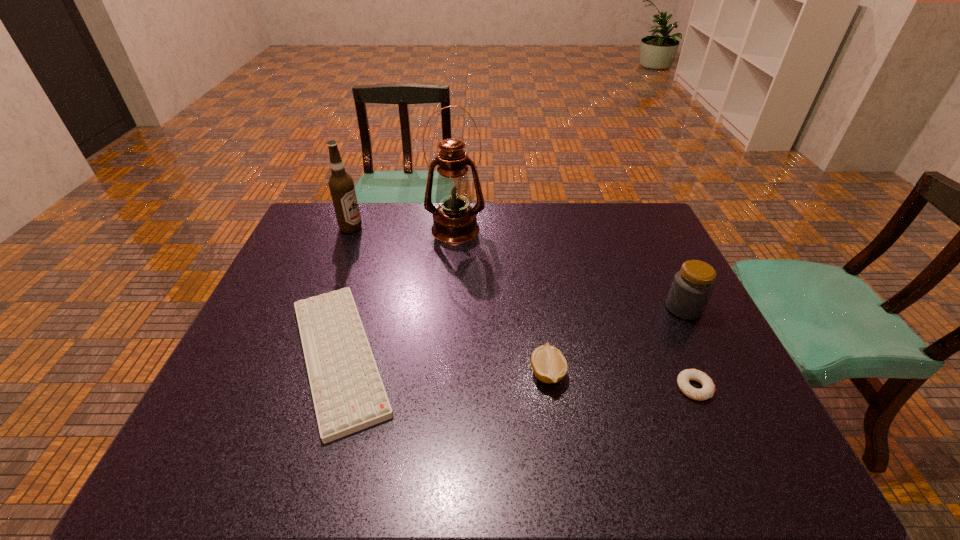
This screenshot has width=960, height=540. I want to click on computer keyboard located at the left edge, so click(348, 393).

The height and width of the screenshot is (540, 960). I want to click on jar that is at the right edge, so pyautogui.click(x=692, y=286).

At what (x,y) coordinates should I click in order to perform the action: click on doughnut at the right edge. Please return your answer as a coordinate pair (x, y). The height and width of the screenshot is (540, 960). Looking at the image, I should click on (708, 390).

You are a GUI agent. You are given a task and a screenshot of the screen. Output one action in this format:
    pyautogui.click(x=<x>, y=<y>)
    Task: Click on the object that is at the far left corner
    The image size is (960, 540).
    Given the screenshot: What is the action you would take?
    pyautogui.click(x=341, y=185)

I want to click on object positioned at the near left corner, so click(348, 393).

Where is `free region at the far edge`? free region at the far edge is located at coordinates (553, 228).

Locate an element on the screen. free region at the near edge is located at coordinates (403, 437).

I want to click on vacant space at the left edge of the desktop, so click(257, 306).

In the image, there is a desktop. Where is `vacant space at the far right corner`? vacant space at the far right corner is located at coordinates (666, 239).

Image resolution: width=960 pixels, height=540 pixels. What are the coordinates of `blank space at the near right corner of the desktop` in the screenshot? It's located at (760, 467).